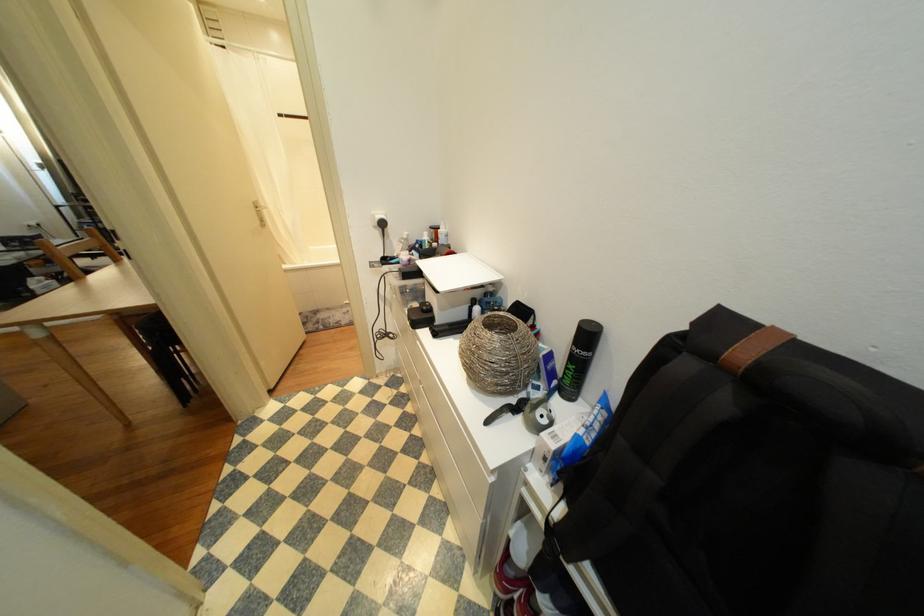
Find where to lift the blue and white box. Please return your answer as a coordinate pair (x, y).

(581, 438)